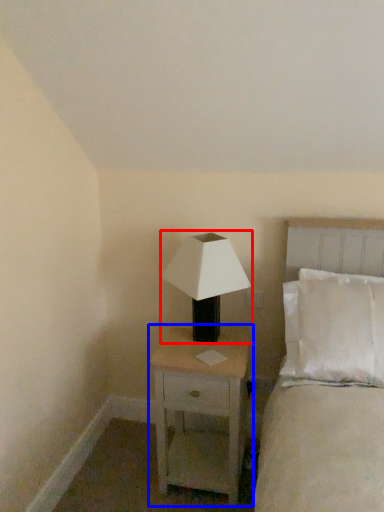
Question: Which point is closer to the camera, lamp (highlighted by a red box) or nightstand (highlighted by a blue box)?

Choices:
 (A) lamp
 (B) nightstand

Answer: (A)